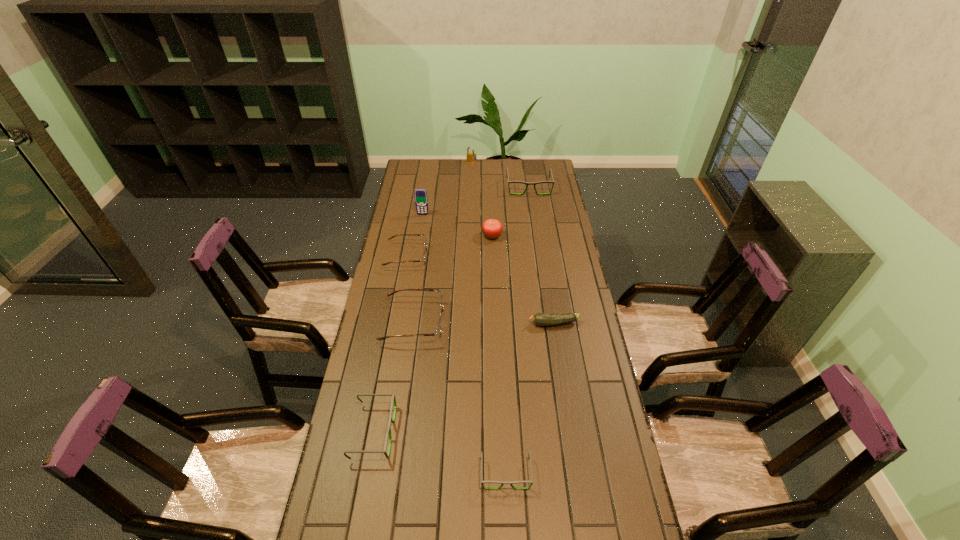
What are the coordinates of `zucchini positioned at the right edge` in the screenshot? It's located at (541, 319).

The width and height of the screenshot is (960, 540). Identify the location of object that is at the far right corner. [527, 183].

You are a GUI agent. You are given a task and a screenshot of the screen. Output one action in this format:
    pyautogui.click(x=<x>, y=<y>)
    Task: Click on the vacant space at the far edge
    The image size is (960, 540).
    Given the screenshot: What is the action you would take?
    [458, 166]

Image resolution: width=960 pixels, height=540 pixels. In the image, there is a desktop. In order to click on free space at the left edge in this screenshot , I will do `click(386, 273)`.

Find the location of a particular element. The height and width of the screenshot is (540, 960). vacant space at the right edge of the desktop is located at coordinates (529, 198).

In order to click on vacant region at the far left corner in this screenshot , I will do `click(429, 164)`.

In the image, there is a desktop. Identify the location of vacant space at the far right corner. (539, 166).

Where is `free space that is in between the tallest object and the leftmost black spectacles`? The image size is (960, 540). free space that is in between the tallest object and the leftmost black spectacles is located at coordinates (398, 323).

The image size is (960, 540). I want to click on vacant space that is in between the second smallest black spectacles and the farther brown spectacles, so click(390, 344).

The width and height of the screenshot is (960, 540). Identify the location of blank region between the tallest object and the zucchini. (489, 269).